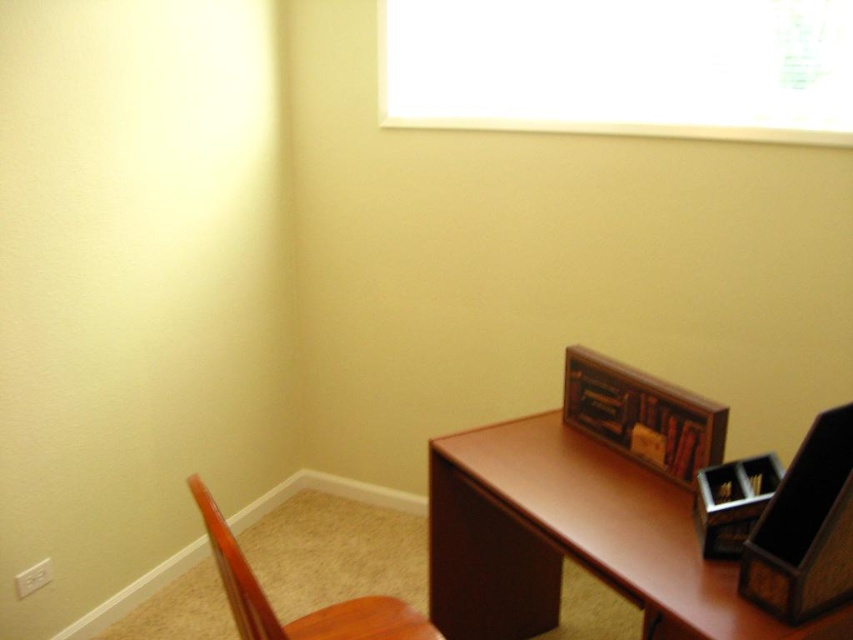
Question: From the image, what is the correct spatial relationship of brown wood computer desk at lower right in relation to wooden chair at lower left?

Choices:
 (A) left
 (B) right

Answer: (B)

Question: Is transparent glass window at upper center smaller than wooden chair at lower left?

Choices:
 (A) yes
 (B) no

Answer: (B)

Question: Which of the following is the closest to the observer?

Choices:
 (A) brown wood computer desk at lower right
 (B) wooden chair at lower left
 (C) transparent glass window at upper center

Answer: (B)

Question: Among these points, which one is farthest from the camera?

Choices:
 (A) (265, 600)
 (B) (567, 3)
 (C) (459, 477)

Answer: (B)

Question: Does transparent glass window at upper center lie behind brown wood computer desk at lower right?

Choices:
 (A) no
 (B) yes

Answer: (B)

Question: Which point is farther from the camera taking this photo?

Choices:
 (A) (593, 458)
 (B) (848, 90)
 (C) (428, 621)

Answer: (B)